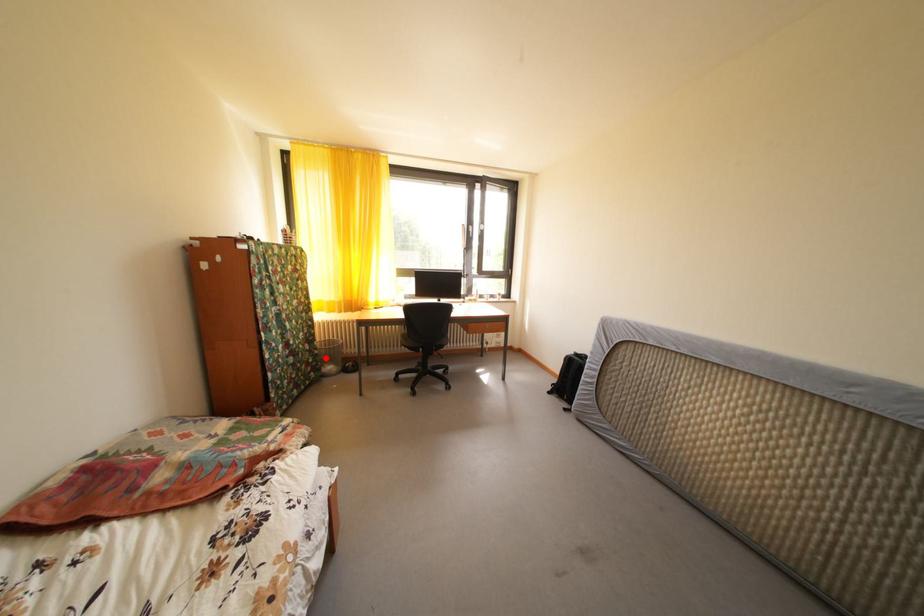
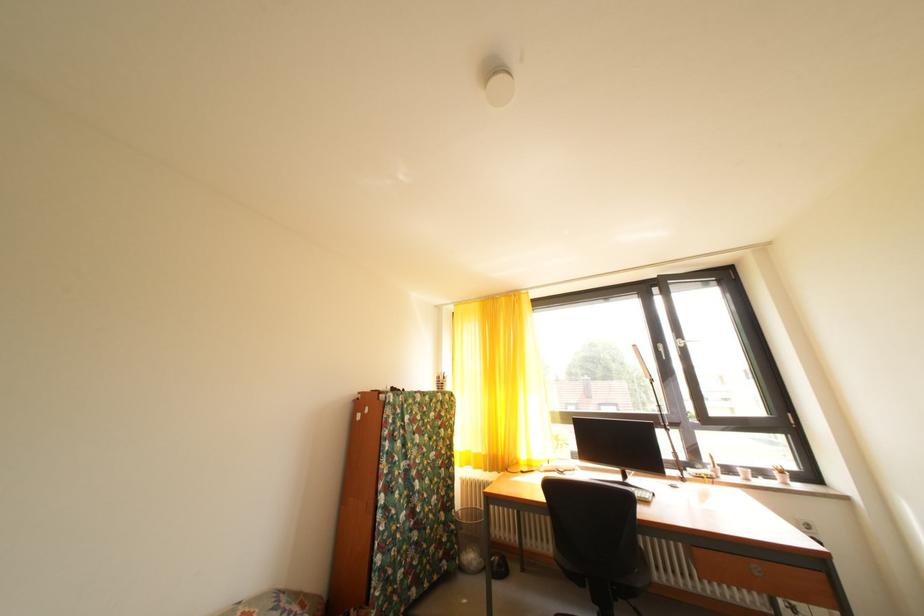
Question: I am providing you with two images of the same scene from different viewpoints. Given a red point in image1, look at the same physical point in image2. Is it:

Choices:
 (A) Closer to the viewpoint
 (B) Farther from the viewpoint

Answer: (B)